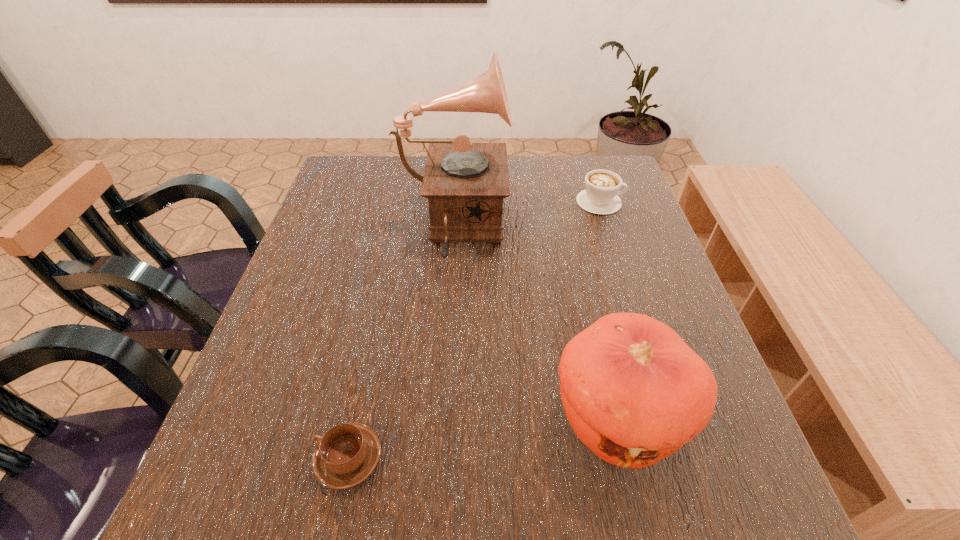
I want to click on vacant region that satisfies the following two spatial constraints: 1. on the front side of the pumpkin; 2. on the side of the shortest object with the handle, so click(627, 458).

Where is `vacant area that satisfies the following two spatial constraints: 1. on the horn of the record player; 2. on the right side of the pumpkin`? vacant area that satisfies the following two spatial constraints: 1. on the horn of the record player; 2. on the right side of the pumpkin is located at coordinates (440, 416).

Find the location of a particular element. The width and height of the screenshot is (960, 540). vacant space that satisfies the following two spatial constraints: 1. on the horn of the tallest object; 2. on the right side of the third shortest object is located at coordinates (440, 416).

The image size is (960, 540). I want to click on blank area in the image that satisfies the following two spatial constraints: 1. on the horn of the record player; 2. on the right side of the third shortest object, so click(440, 416).